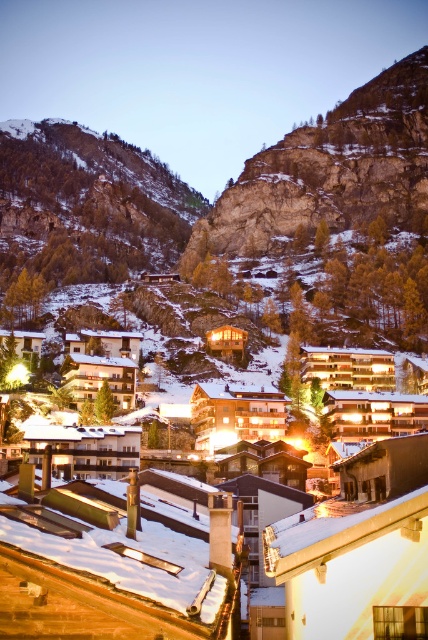
Does snowy rocky cliff at upper left have a larger size compared to rocky cliff at upper center?

Indeed, snowy rocky cliff at upper left has a larger size compared to rocky cliff at upper center.

Is snowy rocky cliff at upper left above rocky cliff at upper center?

No.

Between point (45, 269) and point (258, 195), which one is positioned behind?

Positioned behind is point (258, 195).

What are the coordinates of `snowy rocky cliff at upper left` in the screenshot? It's located at (86, 205).